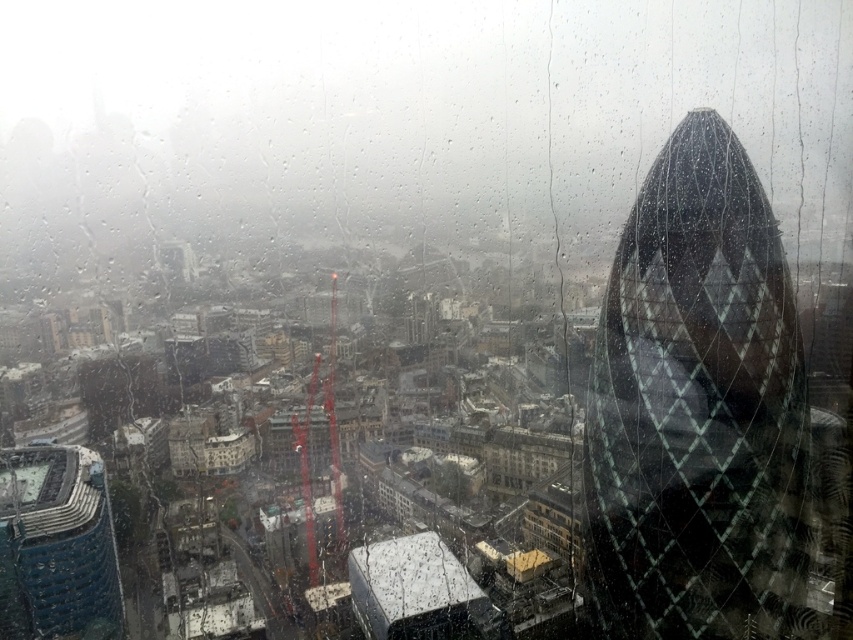
You are looking through a window at a cityscape. There is a point marked at coordinates (698, 412). Which object in the scene does this point belong to?

The point at coordinates (698, 412) is on the glassy diamond patterned tower at right.